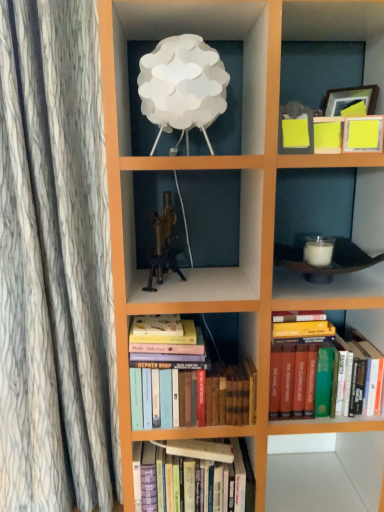
Question: Does white paper lampshade at upper center have a lesser width compared to hardcover books at center, acting as the 1th book starting from the bottom?

Choices:
 (A) yes
 (B) no

Answer: (A)

Question: From the image's perspective, is white paper lampshade at upper center under hardcover books at center, acting as the 3th book starting from the top?

Choices:
 (A) no
 (B) yes

Answer: (A)

Question: Does white paper lampshade at upper center have a greater height compared to hardcover books at center, acting as the 1th book starting from the bottom?

Choices:
 (A) no
 (B) yes

Answer: (A)

Question: Is hardcover books at center, acting as the 3th book starting from the top, at the back of white paper lampshade at upper center?

Choices:
 (A) no
 (B) yes

Answer: (A)

Question: Does white paper lampshade at upper center contain hardcover books at center, acting as the 1th book starting from the bottom?

Choices:
 (A) no
 (B) yes

Answer: (A)

Question: In the image, is brass metallic tripod at center on the left side or the right side of hardcover books at lower right, the 3th book ordered from the bottom?

Choices:
 (A) right
 (B) left

Answer: (B)

Question: From a real-world perspective, is brass metallic tripod at center positioned above or below hardcover books at lower right, the 3th book ordered from the bottom?

Choices:
 (A) above
 (B) below

Answer: (A)

Question: Choose the correct answer: Is brass metallic tripod at center inside hardcover books at lower right, the 3th book ordered from the bottom, or outside it?

Choices:
 (A) inside
 (B) outside

Answer: (B)

Question: Relative to hardcover books at lower right, the 1th book in the top-to-bottom sequence, is brass metallic tripod at center in front or behind?

Choices:
 (A) front
 (B) behind

Answer: (A)

Question: Is hardcover books at center, the second book in the bottom-to-top sequence, inside the boundaries of white paper lampshade at upper center, or outside?

Choices:
 (A) outside
 (B) inside

Answer: (A)

Question: From a real-world perspective, is hardcover books at center, the second book in the bottom-to-top sequence, above or below white paper lampshade at upper center?

Choices:
 (A) above
 (B) below

Answer: (B)

Question: Considering the positions of hardcover books at center, the second book in the bottom-to-top sequence, and white paper lampshade at upper center in the image, is hardcover books at center, the second book in the bottom-to-top sequence, taller or shorter than white paper lampshade at upper center?

Choices:
 (A) tall
 (B) short

Answer: (A)

Question: In the image, is hardcover books at center, the second book in the bottom-to-top sequence, on the left side or the right side of white paper lampshade at upper center?

Choices:
 (A) left
 (B) right

Answer: (B)

Question: Is hardcover books at lower right, the 3th book ordered from the bottom, wider or thinner than hardcover books at center, the second book in the bottom-to-top sequence?

Choices:
 (A) wide
 (B) thin

Answer: (A)

Question: From a real-world perspective, relative to hardcover books at center, the second book in the bottom-to-top sequence, is hardcover books at lower right, the 3th book ordered from the bottom, vertically above or below?

Choices:
 (A) below
 (B) above

Answer: (B)